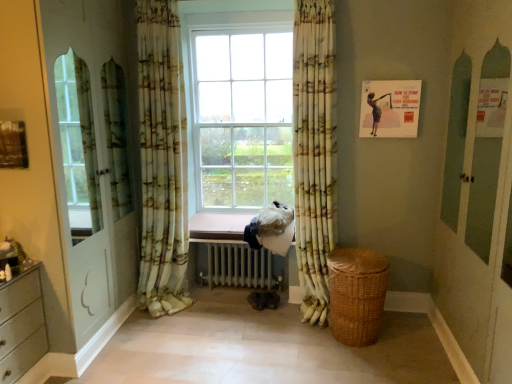
I want to click on vacant space in front of yellow-green floral fabric curtain at center, the second curtain when ordered from left to right, so click(303, 341).